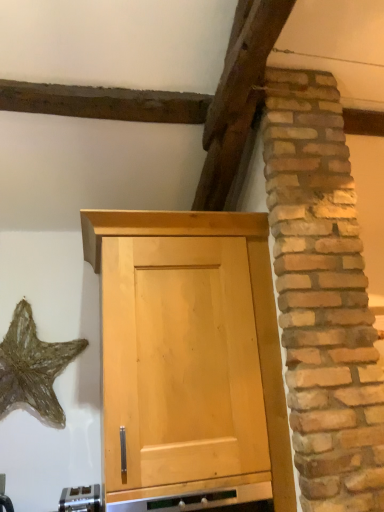
Find the location of a particular element. This screenshot has height=512, width=384. light wood cabinet at center is located at coordinates (189, 361).

In order to face gold metallic starfish at lower left, should I rotate leftwards or rightwards?

Rotate your view left by about 19.391°.

At what (x,y) coordinates should I click in order to perform the action: click on satin silver toaster at lower center. Please return your answer as a coordinate pair (x, y). Looking at the image, I should click on (80, 499).

From the image's perspective, which object appears higher, gold metallic starfish at lower left or satin silver toaster at lower center?

gold metallic starfish at lower left, from the image's perspective.

From a real-world perspective, is gold metallic starfish at lower left positioned above or below satin silver toaster at lower center?

gold metallic starfish at lower left is situated higher than satin silver toaster at lower center in the real world.

Would you say gold metallic starfish at lower left is a long distance from satin silver toaster at lower center?

They are positioned close to each other.

From the image's perspective, which object appears higher, light wood cabinet at center or satin silver toaster at lower center?

light wood cabinet at center.

Considering the relative positions of light wood cabinet at center and satin silver toaster at lower center in the image provided, is light wood cabinet at center to the left of satin silver toaster at lower center from the viewer's perspective?

Incorrect, light wood cabinet at center is not on the left side of satin silver toaster at lower center.

Is light wood cabinet at center situated inside satin silver toaster at lower center or outside?

light wood cabinet at center lies outside satin silver toaster at lower center.

Is gold metallic starfish at lower left taller or shorter than light wood cabinet at center?

In the image, gold metallic starfish at lower left appears to be shorter than light wood cabinet at center.

Is gold metallic starfish at lower left surrounding light wood cabinet at center?

No, light wood cabinet at center is located outside of gold metallic starfish at lower left.

Is point (31, 323) positioned after point (155, 471)?

Yes, point (31, 323) is farther from viewer.

From the image's perspective, which object appears higher, gold metallic starfish at lower left or light wood cabinet at center?

gold metallic starfish at lower left appears higher in the image.

From the picture: Considering the sizes of objects satin silver toaster at lower center and light wood cabinet at center in the image provided, who is taller, satin silver toaster at lower center or light wood cabinet at center?

light wood cabinet at center is taller.

Is light wood cabinet at center inside satin silver toaster at lower center?

No, light wood cabinet at center is not inside satin silver toaster at lower center.

In terms of size, does satin silver toaster at lower center appear bigger or smaller than light wood cabinet at center?

Considering their sizes, satin silver toaster at lower center takes up less space than light wood cabinet at center.

Is the surface of satin silver toaster at lower center in direct contact with light wood cabinet at center?

They are not placed beside each other.

Considering the relative positions of satin silver toaster at lower center and gold metallic starfish at lower left in the image provided, is satin silver toaster at lower center to the left of gold metallic starfish at lower left from the viewer's perspective?

Result: Incorrect, satin silver toaster at lower center is not on the left side of gold metallic starfish at lower left.

Is satin silver toaster at lower center inside the boundaries of gold metallic starfish at lower left, or outside?

satin silver toaster at lower center is located beyond the bounds of gold metallic starfish at lower left.

How different are the orientations of satin silver toaster at lower center and gold metallic starfish at lower left in degrees?

The angle between the facing direction of satin silver toaster at lower center and the facing direction of gold metallic starfish at lower left is 0.0626 degrees.

You are a GUI agent. You are given a task and a screenshot of the screen. Output one action in this format:
    pyautogui.click(x=<x>, y=<y>)
    Task: Click on the star on the left of satin silver toaster at lower center
    This screenshot has height=512, width=384.
    Given the screenshot: What is the action you would take?
    pyautogui.click(x=33, y=367)

From the image's perspective, is light wood cabinet at center above or below gold metallic starfish at lower left?

light wood cabinet at center is below gold metallic starfish at lower left.

Which object is further away from the camera taking this photo, light wood cabinet at center or gold metallic starfish at lower left?

Positioned behind is gold metallic starfish at lower left.

Consider the image. Considering the sizes of objects light wood cabinet at center and gold metallic starfish at lower left in the image provided, who is smaller, light wood cabinet at center or gold metallic starfish at lower left?

gold metallic starfish at lower left is smaller.

Between light wood cabinet at center and gold metallic starfish at lower left, which one has larger width?

light wood cabinet at center.

At what (x,y) coordinates should I click in order to perform the action: click on appliance in front of the gold metallic starfish at lower left. Please return your answer as a coordinate pair (x, y). This screenshot has height=512, width=384. Looking at the image, I should click on (80, 499).

Find the location of a particular element. appliance on the left of light wood cabinet at center is located at coordinates (80, 499).

When comparing their distances from light wood cabinet at center, does gold metallic starfish at lower left or satin silver toaster at lower center seem closer?

satin silver toaster at lower center.

When comparing their distances from gold metallic starfish at lower left, does satin silver toaster at lower center or light wood cabinet at center seem closer?

The object closer to gold metallic starfish at lower left is satin silver toaster at lower center.

Estimate the real-world distances between objects in this image. Which object is closer to gold metallic starfish at lower left, light wood cabinet at center or satin silver toaster at lower center?

satin silver toaster at lower center is positioned closer to the anchor gold metallic starfish at lower left.

Estimate the real-world distances between objects in this image. Which object is further from satin silver toaster at lower center, light wood cabinet at center or gold metallic starfish at lower left?

Among the two, light wood cabinet at center is located further to satin silver toaster at lower center.

Looking at the image, which one is located closer to satin silver toaster at lower center, gold metallic starfish at lower left or light wood cabinet at center?

gold metallic starfish at lower left is closer to satin silver toaster at lower center.

When comparing their distances from light wood cabinet at center, does satin silver toaster at lower center or gold metallic starfish at lower left seem closer?

satin silver toaster at lower center is closer to light wood cabinet at center.

Where is `cupboard that lies between gold metallic starfish at lower left and satin silver toaster at lower center from top to bottom`? cupboard that lies between gold metallic starfish at lower left and satin silver toaster at lower center from top to bottom is located at coordinates (189, 361).